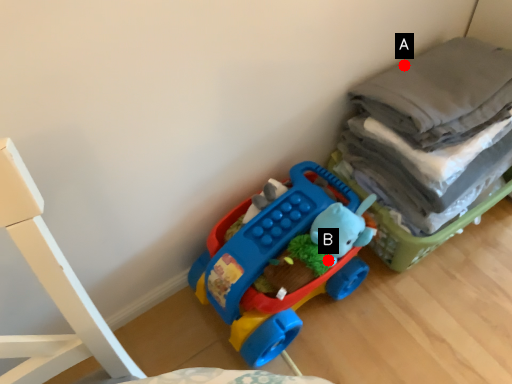
Question: Two points are circled on the image, labeled by A and B beside each circle. Which point is closer to the camera?

Choices:
 (A) A is closer
 (B) B is closer

Answer: (B)